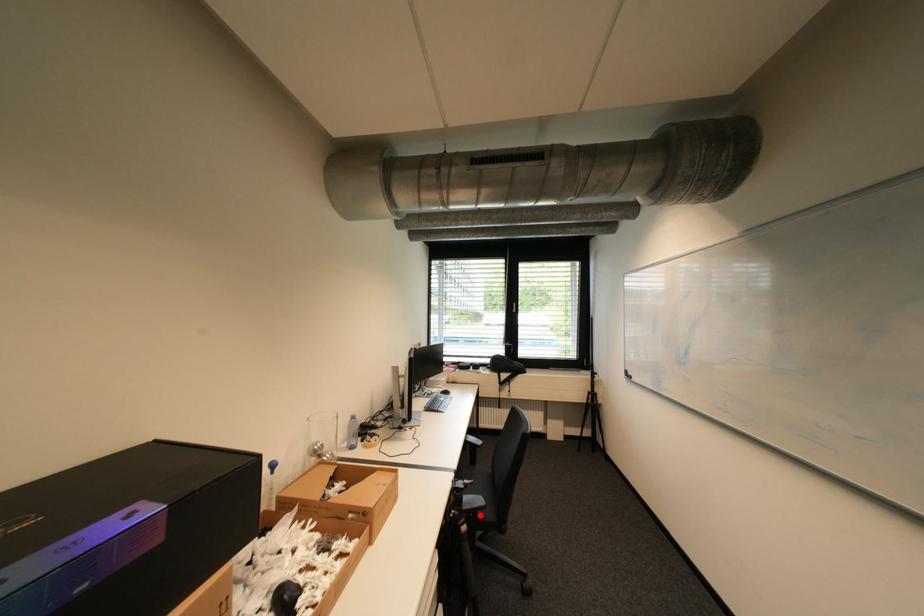
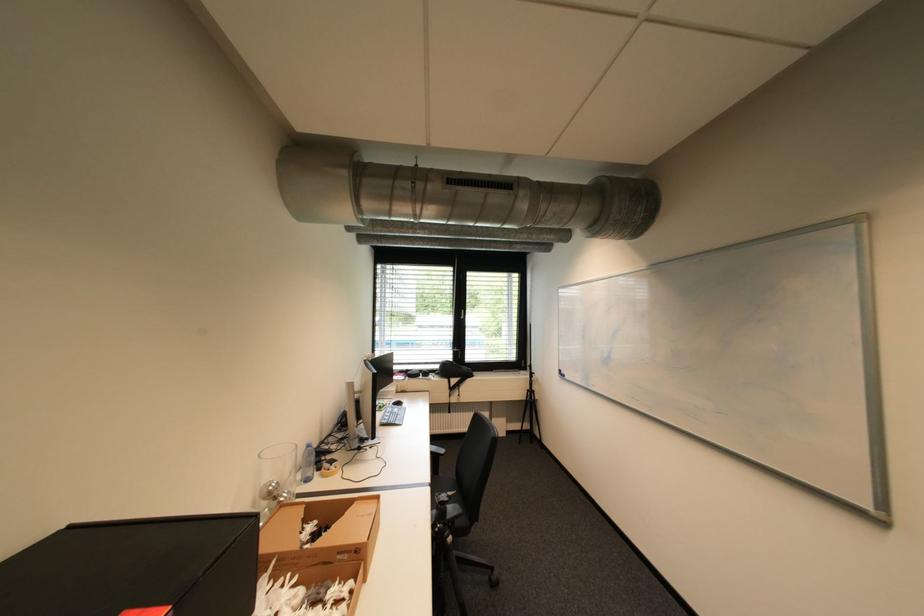
Locate, in the second image, the point that corresponds to the highlighted location in the first image.

(458, 525)